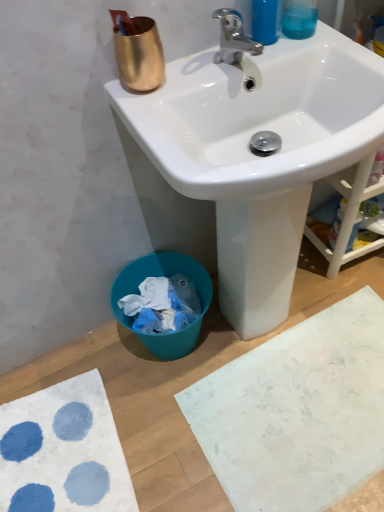
Identify the location of vacant space underneath white matte bath mat at lower right, positioned as the 2th bath mat in left-to-right order (from a real-world perspective). (309, 418).